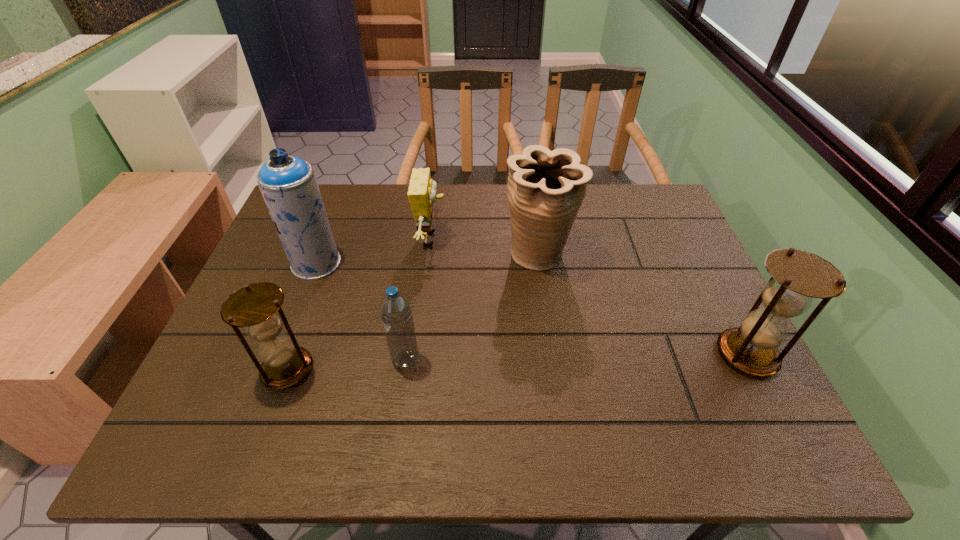
Where is `free space located on the face of the sponge`? Image resolution: width=960 pixels, height=540 pixels. free space located on the face of the sponge is located at coordinates (471, 239).

Locate an element on the screen. The image size is (960, 540). vacant space located on the left of the water bottle is located at coordinates (311, 360).

Find the location of a particular element. The height and width of the screenshot is (540, 960). free location located on the right of the tallest object is located at coordinates (483, 264).

At what (x,y) coordinates should I click in order to perform the action: click on object present at the far edge. Please return your answer as a coordinate pair (x, y). The height and width of the screenshot is (540, 960). Looking at the image, I should click on (422, 190).

In order to click on water bottle located in the near edge section of the desktop in this screenshot , I will do (395, 309).

Identify the location of hourglass at the left edge. (257, 307).

Locate an element on the screen. aerosol can at the left edge is located at coordinates (288, 184).

The image size is (960, 540). Identify the location of object that is at the right edge. [x=798, y=276].

This screenshot has width=960, height=540. Identify the location of object located at the near left corner. (257, 307).

Identify the location of object situated at the near right corner. This screenshot has width=960, height=540. (798, 276).